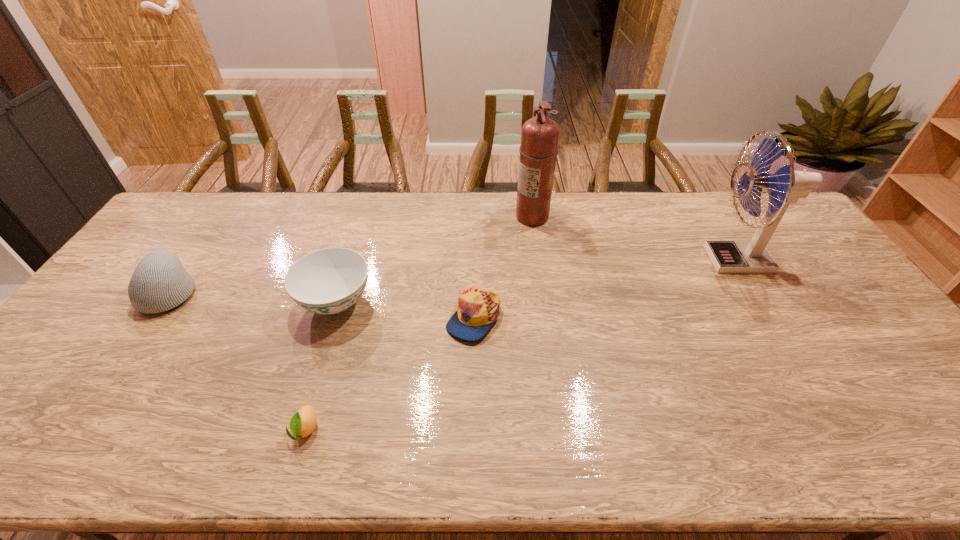
Identify the location of object at the left edge. (159, 283).

Locate an element on the screen. vacant space at the far edge of the desktop is located at coordinates (620, 192).

Identify the location of vacant space at the left edge of the desktop. Image resolution: width=960 pixels, height=540 pixels. (99, 307).

Where is `free spot at the right edge of the desktop`? This screenshot has width=960, height=540. free spot at the right edge of the desktop is located at coordinates (914, 396).

This screenshot has width=960, height=540. In the image, there is a desktop. Find the location of `vacant space at the far left corner`. vacant space at the far left corner is located at coordinates (177, 231).

Find the location of a particular element. vacant region between the lemon and the beanie is located at coordinates (238, 360).

Find the location of a particular element. Image resolution: width=960 pixels, height=540 pixels. unoccupied position between the lemon and the leftmost object is located at coordinates (238, 360).

This screenshot has height=540, width=960. What are the coordinates of `free point between the farthest object and the shortest object` in the screenshot? It's located at (419, 323).

At what (x,y) coordinates should I click in order to perform the action: click on free point between the second object from right to left and the cap. Please return your answer as a coordinate pair (x, y). The height and width of the screenshot is (540, 960). Looking at the image, I should click on (503, 267).

In order to click on vacant space that's between the lemon and the second shortest object in this screenshot , I will do `click(389, 373)`.